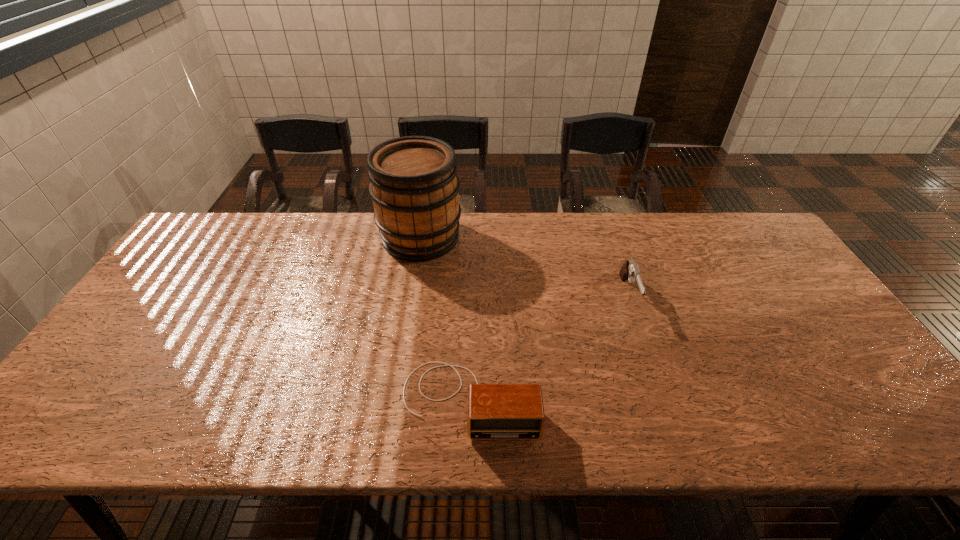
The width and height of the screenshot is (960, 540). In order to click on the tallest object in this screenshot , I will do `click(414, 186)`.

At what (x,y) coordinates should I click in order to perform the action: click on the farthest object. Please return your answer as a coordinate pair (x, y). This screenshot has width=960, height=540. Looking at the image, I should click on (414, 186).

In order to click on the rightmost object in this screenshot , I will do `click(630, 270)`.

The height and width of the screenshot is (540, 960). I want to click on gun, so click(630, 270).

I want to click on radio receiver, so click(x=494, y=411).

Identify the location of free space located on the right of the tallest object. The image size is (960, 540). (550, 238).

Locate an element on the screen. vacant space located at the muzzle of the gun is located at coordinates (649, 354).

You are a GUI agent. You are given a task and a screenshot of the screen. Output one action in this format:
    pyautogui.click(x=<x>, y=<y>)
    Task: Click on the object at the far edge
    The width and height of the screenshot is (960, 540).
    Given the screenshot: What is the action you would take?
    pyautogui.click(x=414, y=186)

Find the location of a particular element. This screenshot has width=960, height=540. object positioned at the near edge is located at coordinates (494, 411).

Where is `free space at the far edge`? free space at the far edge is located at coordinates (379, 244).